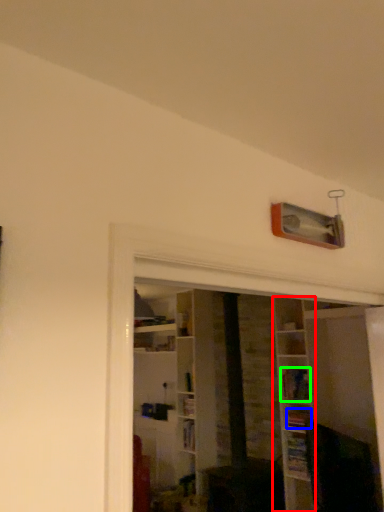
Question: Which object is the farthest from shelf (highlighted by a red box)? Choose among these: book (highlighted by a blue box) or book (highlighted by a green box).

Choices:
 (A) book
 (B) book

Answer: (A)